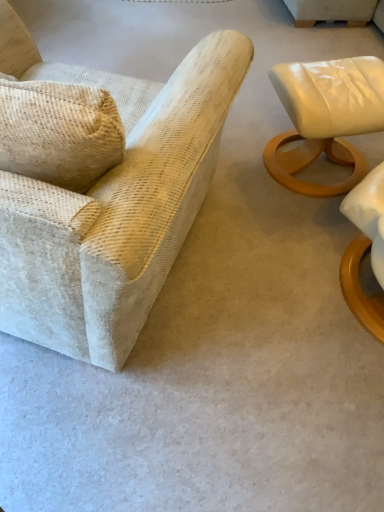
Question: Do you think matte white leather ottoman at right, positioned as the 1th chair in right-to-left order, is within textured beige armchair at left, arranged as the 1th chair when viewed from the left, or outside of it?

Choices:
 (A) outside
 (B) inside

Answer: (A)

Question: Relative to textured beige armchair at left, arranged as the 1th chair when viewed from the left, is matte white leather ottoman at right, the second chair viewed from the left, in front or behind?

Choices:
 (A) front
 (B) behind

Answer: (B)

Question: In terms of height, does matte white leather ottoman at right, the second chair viewed from the left, look taller or shorter compared to textured beige armchair at left, which appears as the second chair when viewed from the right?

Choices:
 (A) short
 (B) tall

Answer: (A)

Question: Looking at the image, does textured beige armchair at left, arranged as the 1th chair when viewed from the left, seem bigger or smaller compared to matte white leather ottoman at right, positioned as the 1th chair in right-to-left order?

Choices:
 (A) small
 (B) big

Answer: (B)

Question: Considering the positions of textured beige armchair at left, which appears as the second chair when viewed from the right, and matte white leather ottoman at right, the second chair viewed from the left, in the image, is textured beige armchair at left, which appears as the second chair when viewed from the right, wider or thinner than matte white leather ottoman at right, the second chair viewed from the left,?

Choices:
 (A) wide
 (B) thin

Answer: (A)

Question: Visually, is textured beige armchair at left, arranged as the 1th chair when viewed from the left, positioned to the left or to the right of matte white leather ottoman at right, the second chair viewed from the left?

Choices:
 (A) right
 (B) left

Answer: (B)

Question: Is textured beige armchair at left, which appears as the second chair when viewed from the right, inside or outside of matte white leather ottoman at right, the second chair viewed from the left?

Choices:
 (A) outside
 (B) inside

Answer: (A)